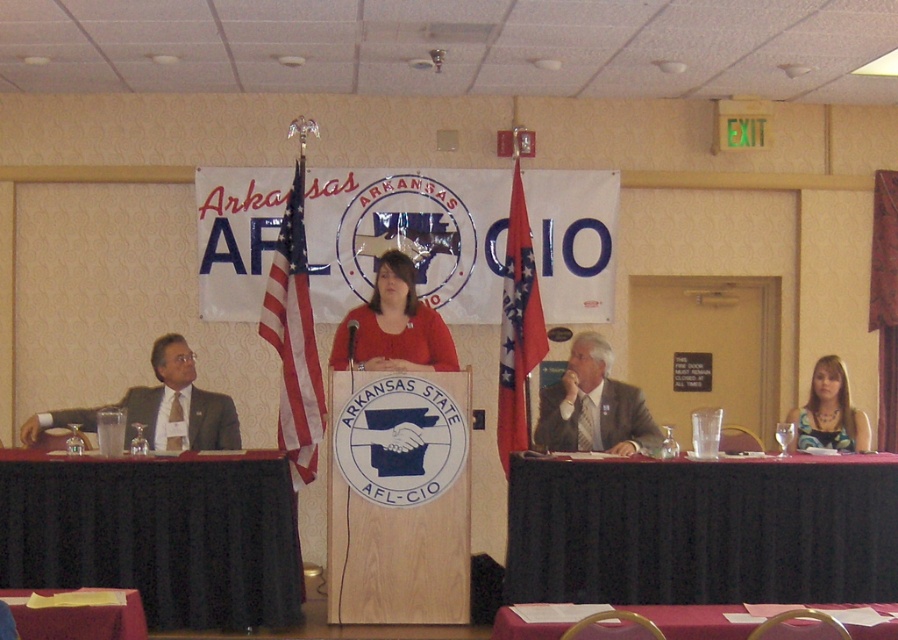
Describe the element at coordinates (160, 406) in the screenshot. I see `matte gray suit at left` at that location.

Is point (183, 369) closer to viewer compared to point (129, 627)?

No, it is not.

Where is `matte gray suit at left`? This screenshot has height=640, width=898. matte gray suit at left is located at coordinates (160, 406).

Does red-white striped flag at center appear on the right side of smooth red tablecloth at lower left?

Indeed, red-white striped flag at center is positioned on the right side of smooth red tablecloth at lower left.

Where is `red-white striped flag at center`? red-white striped flag at center is located at coordinates (295, 340).

Is point (295, 275) closer to camera compared to point (25, 637)?

That is False.

Locate an element on the screen. The height and width of the screenshot is (640, 898). red-white striped flag at center is located at coordinates (295, 340).

Between point (600, 365) and point (373, 317), which one is positioned behind?

The point (600, 365) is more distant.

Measure the distance between point (556, 397) and camera.

Point (556, 397) is 6.99 meters away from camera.

Identify the location of gray suit at center. The width and height of the screenshot is (898, 640). (593, 406).